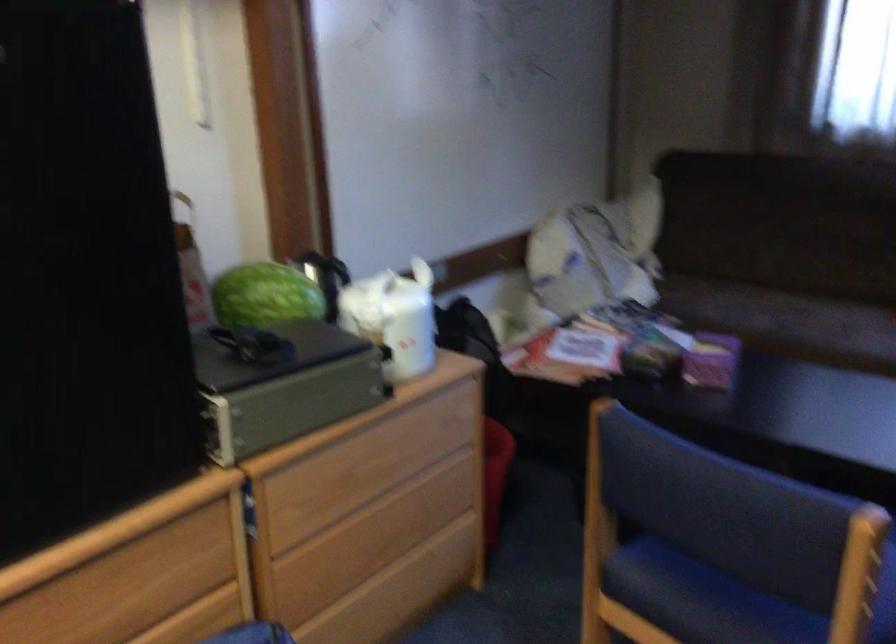
The image size is (896, 644). What do you see at coordinates (858, 574) in the screenshot?
I see `the chair armrest` at bounding box center [858, 574].